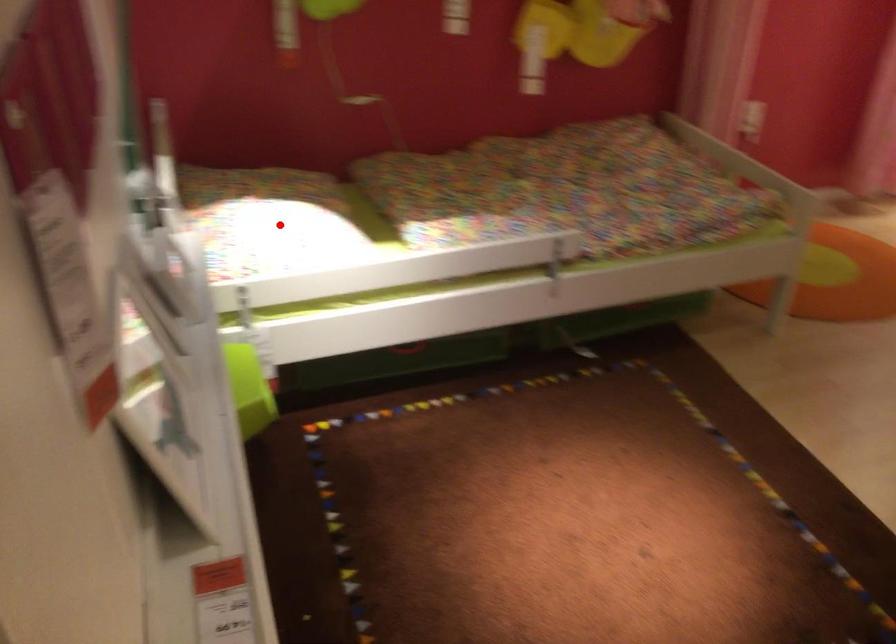
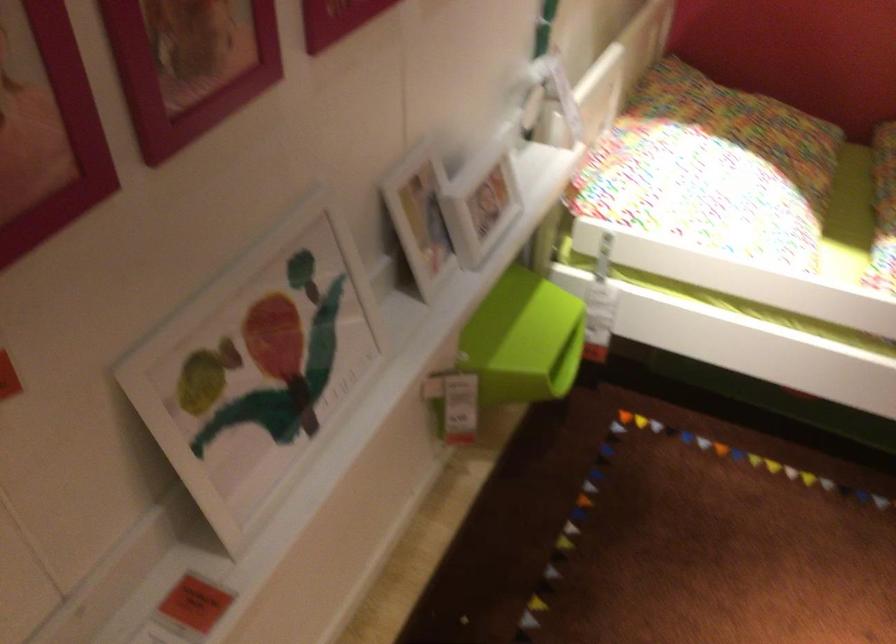
Question: I am providing you with two images of the same scene from different viewpoints. Given a red point in image1, look at the same physical point in image2. Is it:

Choices:
 (A) Closer to the viewpoint
 (B) Farther from the viewpoint

Answer: (A)